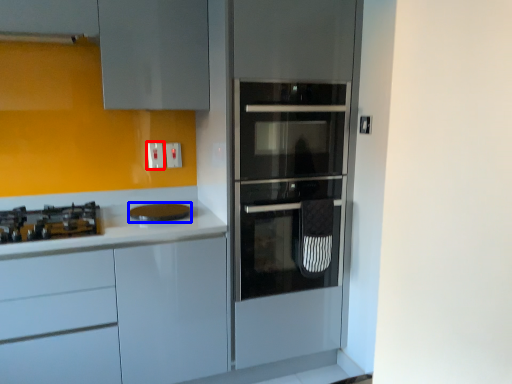
Question: Which object is further to the camera taking this photo, electric outlet (highlighted by a red box) or home appliance (highlighted by a blue box)?

Choices:
 (A) electric outlet
 (B) home appliance

Answer: (A)